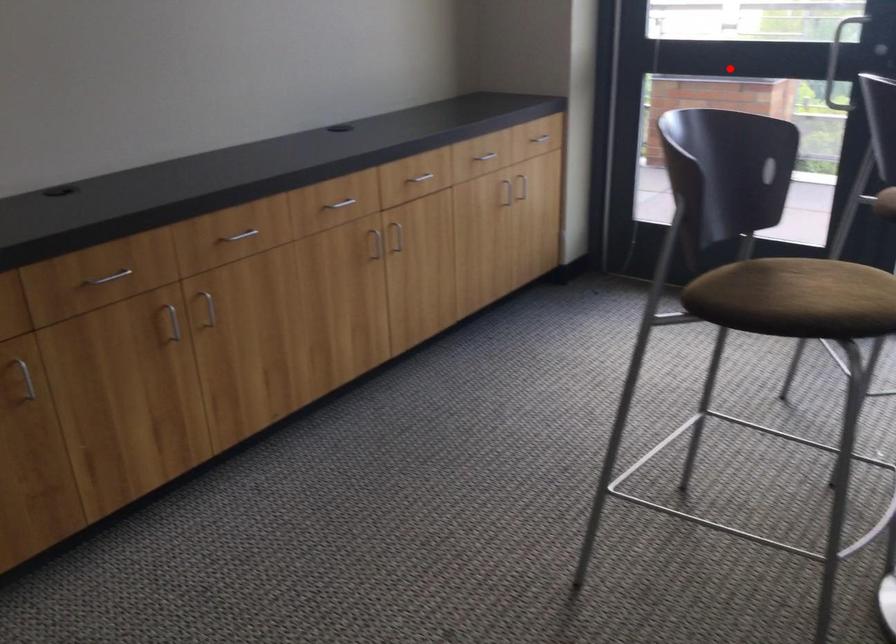
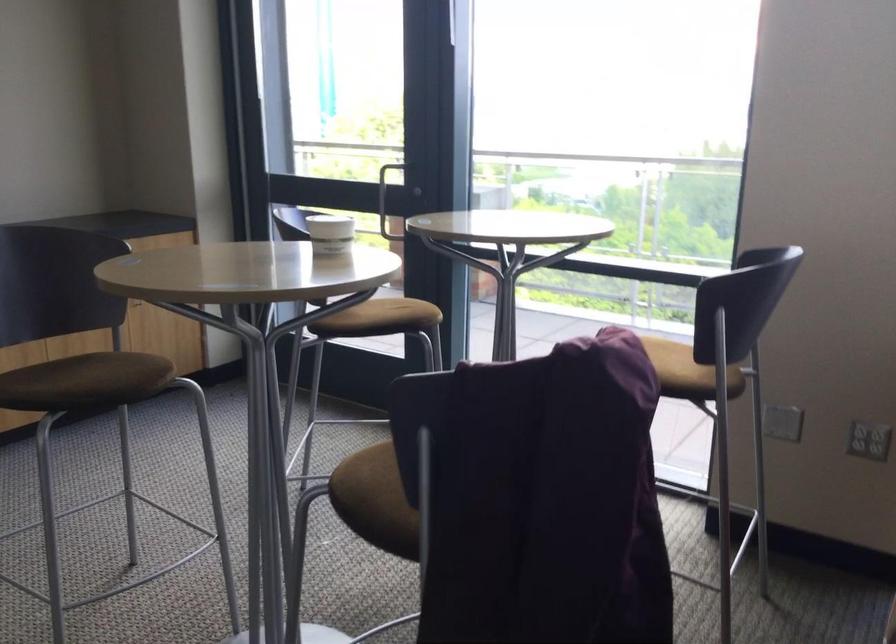
In the second image, find the point that corresponds to the highlighted location in the first image.

(383, 202)